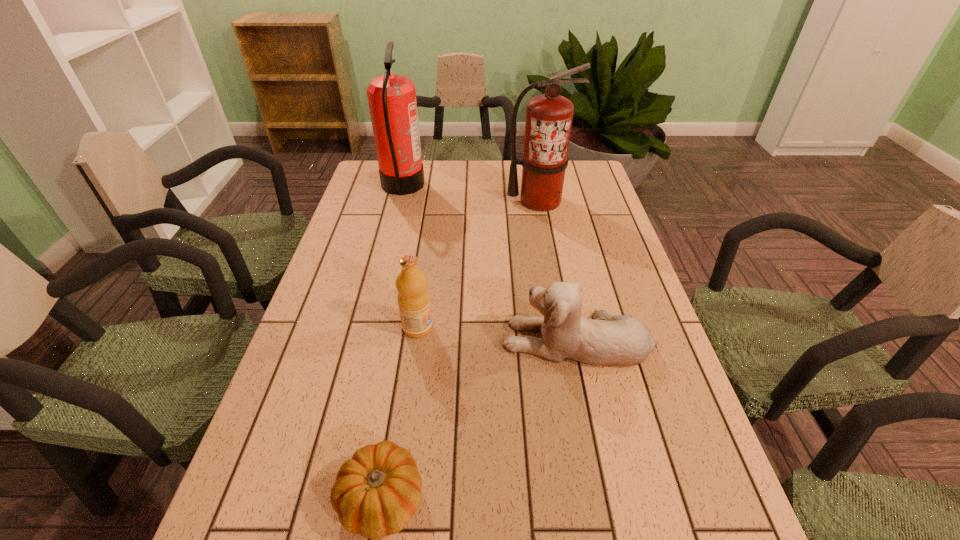
Find the location of `the left fire extinguisher`. the left fire extinguisher is located at coordinates (392, 102).

I want to click on the right fire extinguisher, so click(549, 116).

You are a GUI agent. You are given a task and a screenshot of the screen. Output one action in this format:
    pyautogui.click(x=<x>, y=<y>)
    Task: Click on the third shortest object
    
    Given the screenshot: What is the action you would take?
    pyautogui.click(x=413, y=297)

You are a GUI agent. You are given a task and a screenshot of the screen. Output one action in this format:
    pyautogui.click(x=<x>, y=<y>)
    Task: Click on the puppy
    
    Given the screenshot: What is the action you would take?
    pyautogui.click(x=621, y=340)

The height and width of the screenshot is (540, 960). In order to click on vacant position located 0.250m on the front side of the left fire extinguisher in this screenshot , I will do `click(494, 186)`.

Where is `free space located 0.120m toward the nozzle of the right fire extinguisher`? The height and width of the screenshot is (540, 960). free space located 0.120m toward the nozzle of the right fire extinguisher is located at coordinates (545, 235).

At what (x,y) coordinates should I click in order to perform the action: click on free space located 0.280m on the front label of the third tallest object. Please return your answer as a coordinate pair (x, y). The width and height of the screenshot is (960, 540). Looking at the image, I should click on (549, 328).

The image size is (960, 540). In order to click on blank space located on the front-facing side of the second shortest object in this screenshot , I will do `click(352, 340)`.

Locate an element on the screen. vacant space located on the front-facing side of the second shortest object is located at coordinates tap(446, 340).

Where is `free space located 0.390m on the front-facing side of the second shortest object`? The height and width of the screenshot is (540, 960). free space located 0.390m on the front-facing side of the second shortest object is located at coordinates (335, 340).